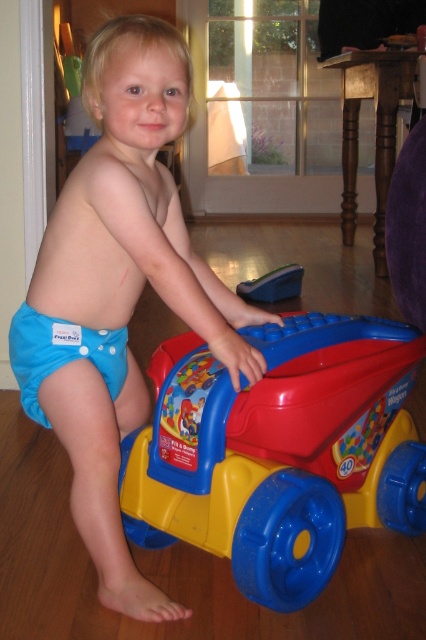
You are a parent trying to choose between two blue fabric diapers for your child. You see the blue fabric diaper at center and the blue fabric diaper at lower left in the image. Which one is taller?

The blue fabric diaper at center is taller than the blue fabric diaper at lower left.

Based on the photo, you are a photographer setting up for a photoshoot. You need to ensure that the blue fabric diaper at lower left and the blue plastic toy car at center are both visible in the frame. Given their sizes, which object should you focus on first to ensure they are both in focus?

The blue fabric diaper at lower left is taller than the blue plastic toy car at center, so you should focus on the taller object first to ensure both are in focus.

You are a parent trying to place a blue fabric diaper at center on top of the blue plastic toy car at center. Based on their sizes, will the diaper fit without hanging over the edges?

The blue fabric diaper at center is wider than the blue plastic toy car at center, so placing the diaper on top would cause it to hang over the edges of the toy car.